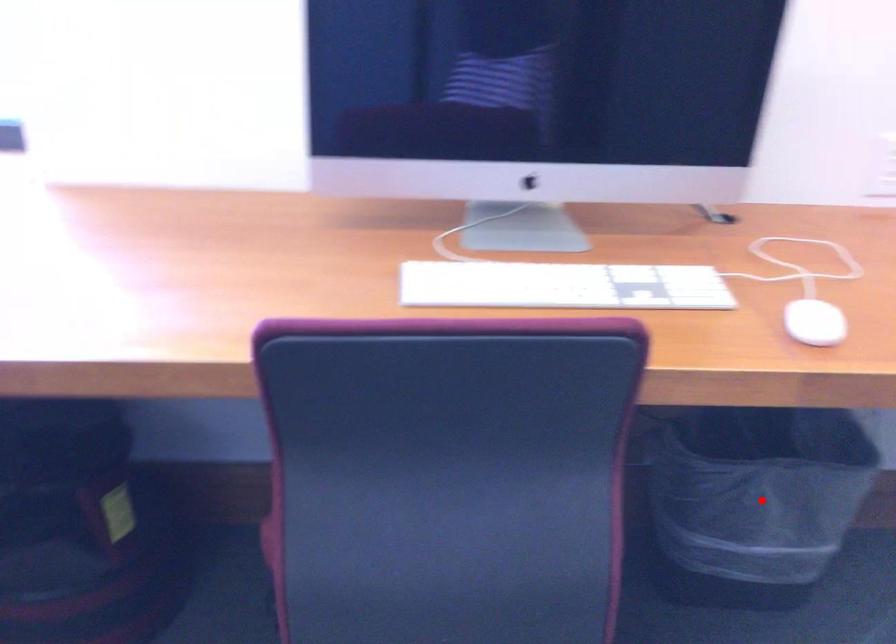
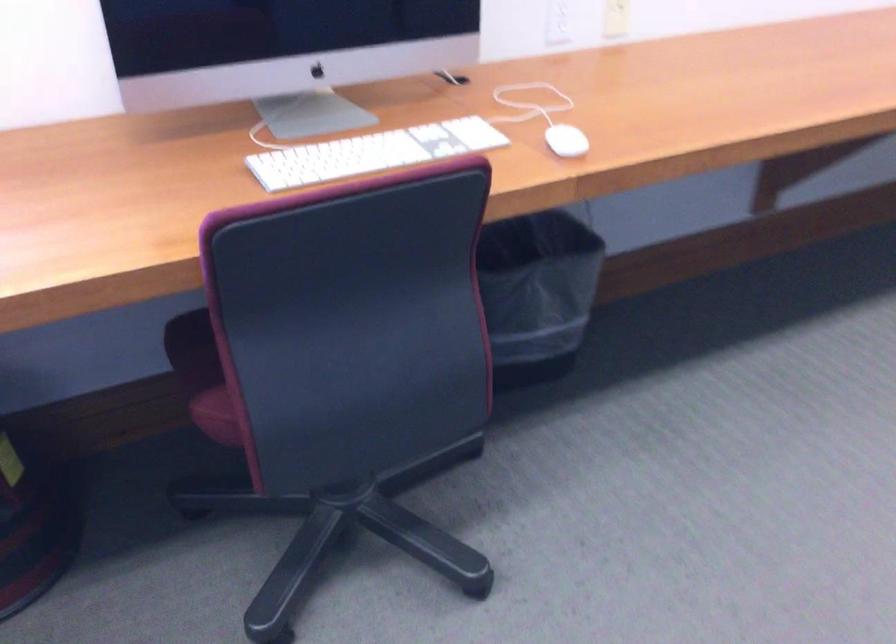
Question: I am providing you with two images of the same scene from different viewpoints. Given a red point in image1, look at the same physical point in image2. Is it:

Choices:
 (A) Closer to the viewpoint
 (B) Farther from the viewpoint

Answer: (B)